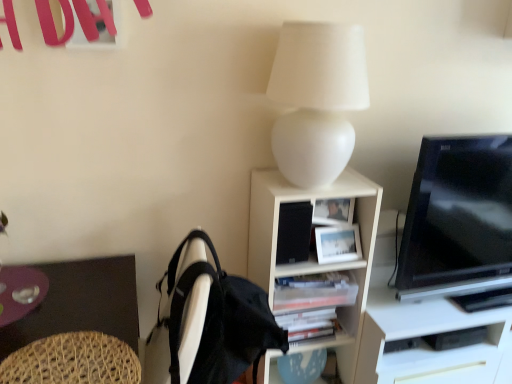
Locate an element on the screen. The height and width of the screenshot is (384, 512). vacant space to the right of transparent glass plate at lower left is located at coordinates (84, 314).